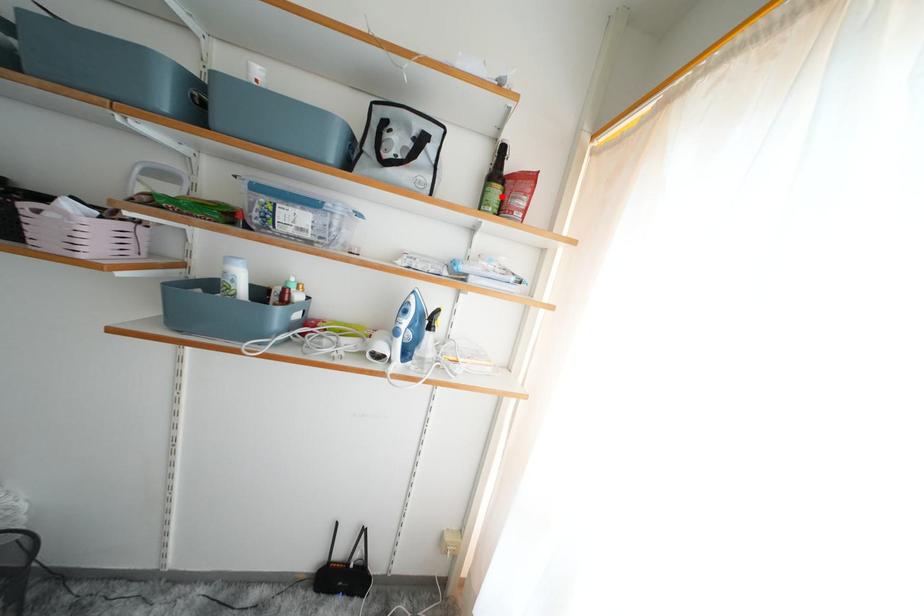
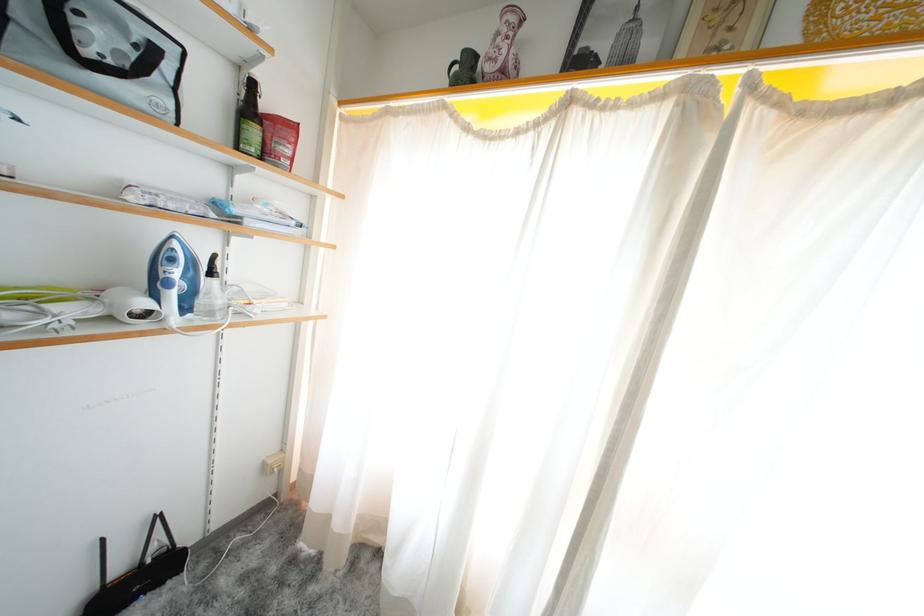
Locate, in the second image, the point that corresponds to the highlighted location in the first image.

(261, 137)